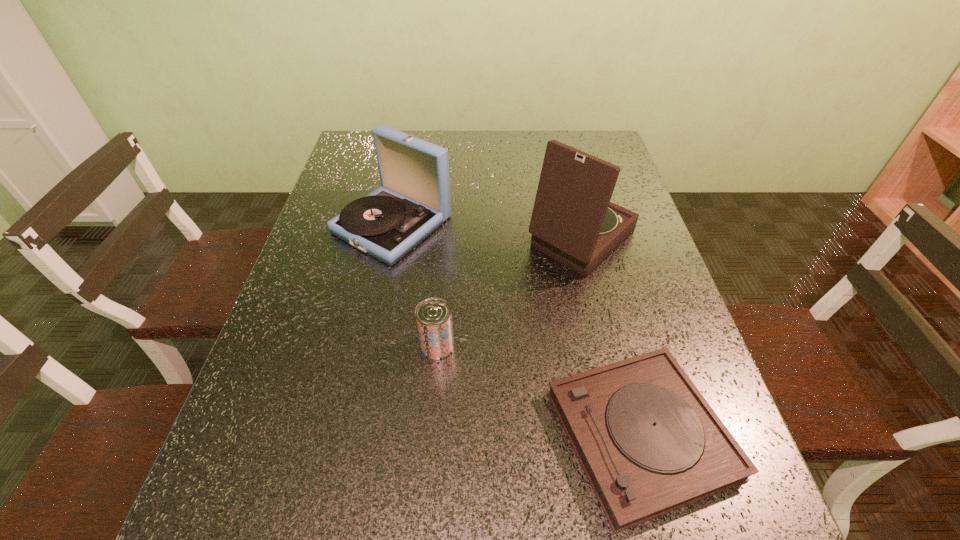
Image resolution: width=960 pixels, height=540 pixels. I want to click on the third closest phonograph record to the second shortest object, so click(x=573, y=221).

Identify the location of phonograph record that is the closest to the tallest phonograph record. (414, 200).

The image size is (960, 540). I want to click on vacant area that satisfies the following two spatial constraints: 1. on the front side of the third tallest object; 2. on the left side of the shortest object, so click(430, 435).

The width and height of the screenshot is (960, 540). Find the location of `blank space that satisfies the following two spatial constraints: 1. on the front side of the leftmost phonograph record; 2. on the left side of the beer can`. blank space that satisfies the following two spatial constraints: 1. on the front side of the leftmost phonograph record; 2. on the left side of the beer can is located at coordinates pos(366,345).

Where is `free space in the image that satisfies the following two spatial constraints: 1. on the front side of the shortest phonograph record; 2. on the right side of the leftmost phonograph record`? This screenshot has width=960, height=540. free space in the image that satisfies the following two spatial constraints: 1. on the front side of the shortest phonograph record; 2. on the right side of the leftmost phonograph record is located at coordinates (347, 435).